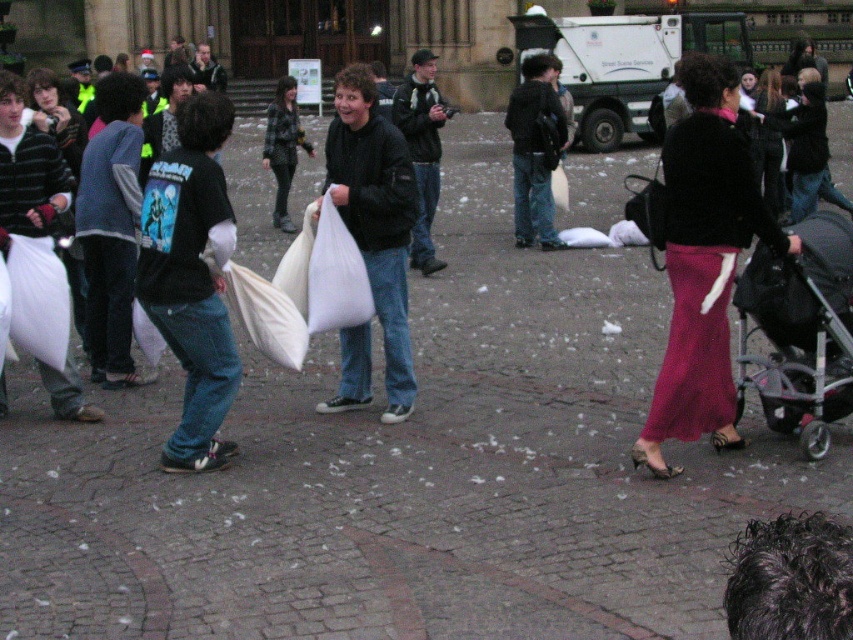
In the scene shown: Is matte black sweater at center positioned before black plastic stroller at lower right?

Yes, it is.

Does matte black sweater at center appear under black plastic stroller at lower right?

Actually, matte black sweater at center is above black plastic stroller at lower right.

This screenshot has width=853, height=640. What are the coordinates of `matte black sweater at center` in the screenshot? It's located at (703, 260).